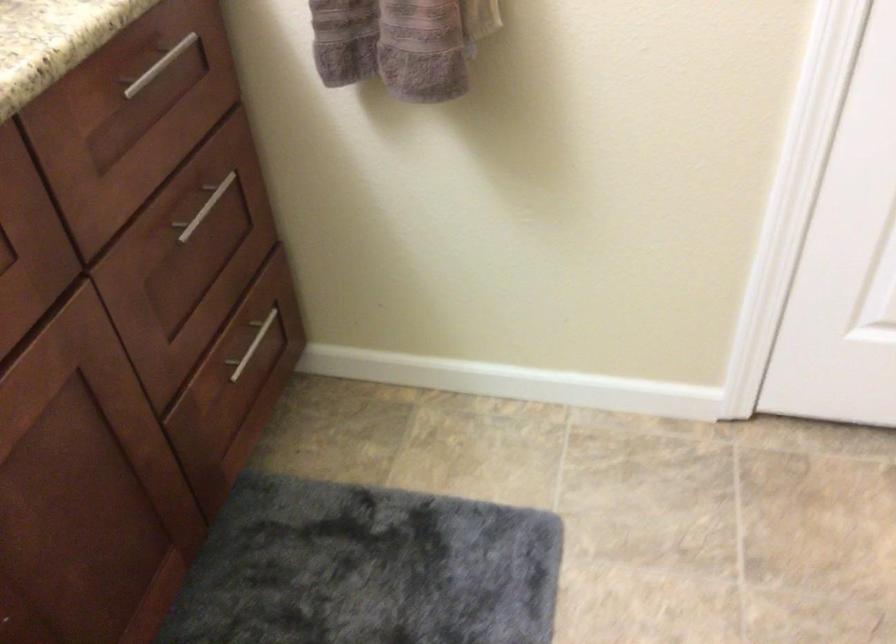
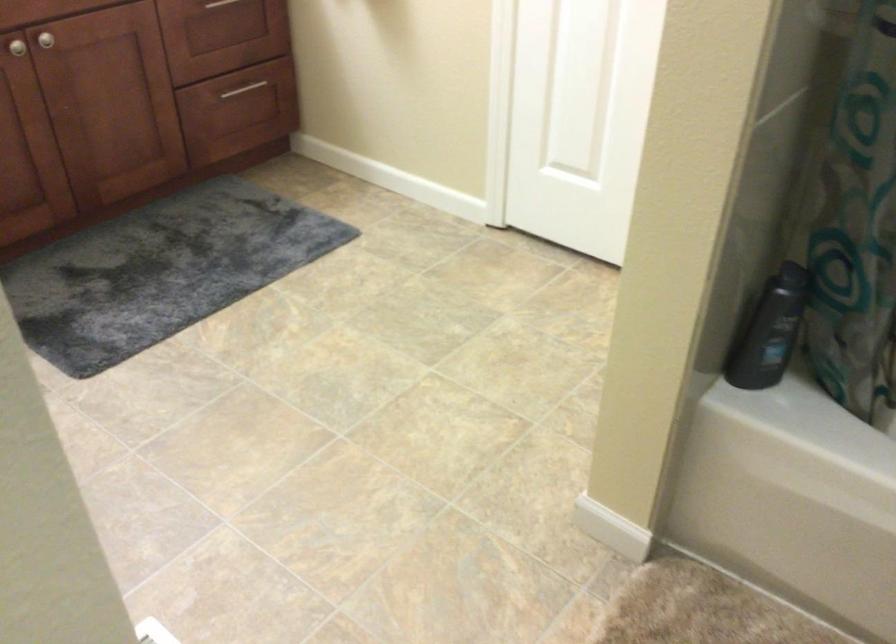
In a continuous first-person perspective shot, in which direction is the camera moving?

The movement direction of the cameraman is right, backward.